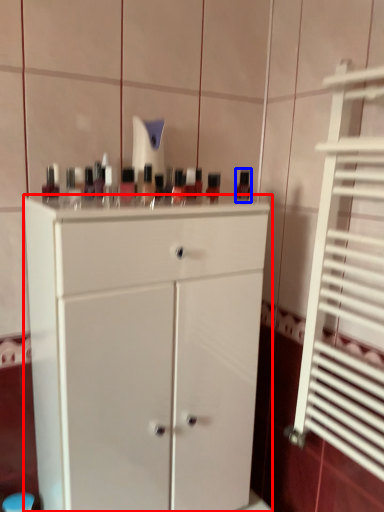
Question: Among these objects, which one is farthest to the camera, chest of drawers (highlighted by a red box) or mouthwash (highlighted by a blue box)?

Choices:
 (A) chest of drawers
 (B) mouthwash

Answer: (B)